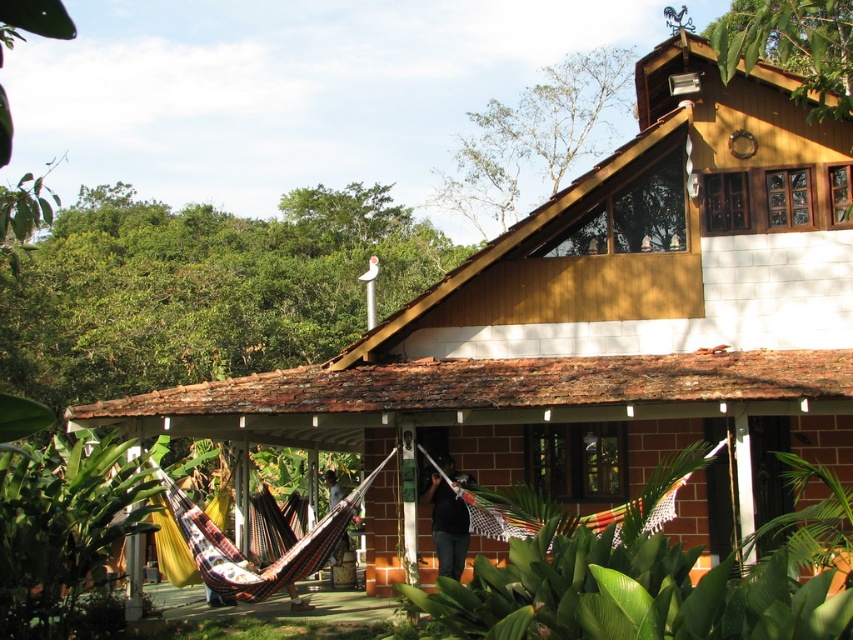
Question: Does green leafy plant at center have a lesser width compared to black fabric at center?

Choices:
 (A) no
 (B) yes

Answer: (A)

Question: Which point is farther to the camera?

Choices:
 (A) (346, 278)
 (B) (602, 602)
 (C) (444, 554)

Answer: (A)

Question: Can you confirm if green leafy plant at center is positioned above black fabric at center?

Choices:
 (A) yes
 (B) no

Answer: (A)

Question: Is the position of green leafy trees at upper left less distant than that of black fabric at center?

Choices:
 (A) no
 (B) yes

Answer: (A)

Question: Which of the following is the closest to the observer?

Choices:
 (A) green leafy trees at upper left
 (B) green leafy plant at center
 (C) black fabric at center

Answer: (B)

Question: Which point appears farthest from the camera in this image?

Choices:
 (A) (431, 508)
 (B) (589, 612)
 (C) (299, 256)

Answer: (C)